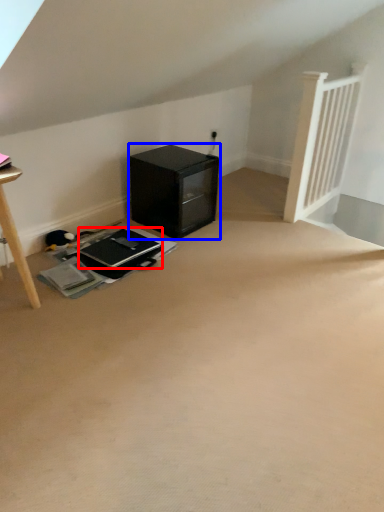
Question: Which object appears farthest to the camera in this image, laptop (highlighted by a red box) or furniture (highlighted by a blue box)?

Choices:
 (A) laptop
 (B) furniture

Answer: (B)